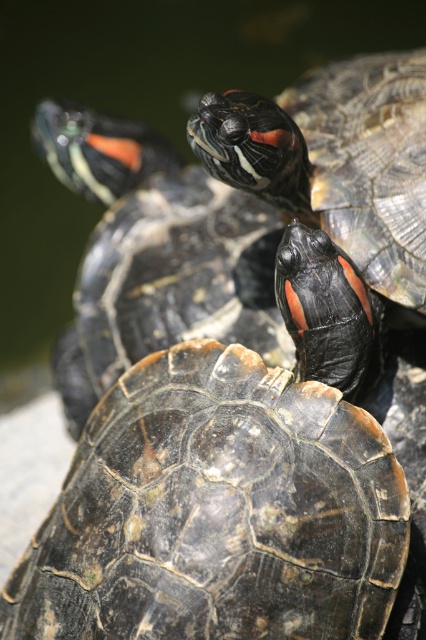
Question: Is shiny dark tortoise at center bigger than shiny black turtle at upper right?

Choices:
 (A) no
 (B) yes

Answer: (B)

Question: Among these objects, which one is nearest to the camera?

Choices:
 (A) shiny black turtle at upper right
 (B) shiny dark tortoise at center

Answer: (B)

Question: Observing the image, what is the correct spatial positioning of shiny dark tortoise at center in reference to shiny black turtle at upper right?

Choices:
 (A) below
 (B) above

Answer: (A)

Question: Can you confirm if shiny dark tortoise at center is bigger than shiny black turtle at upper right?

Choices:
 (A) no
 (B) yes

Answer: (B)